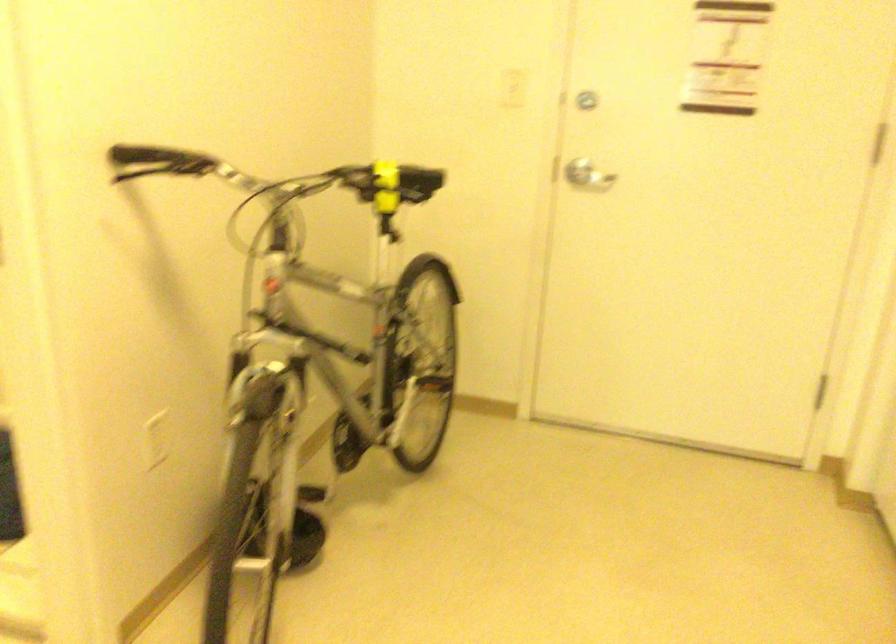
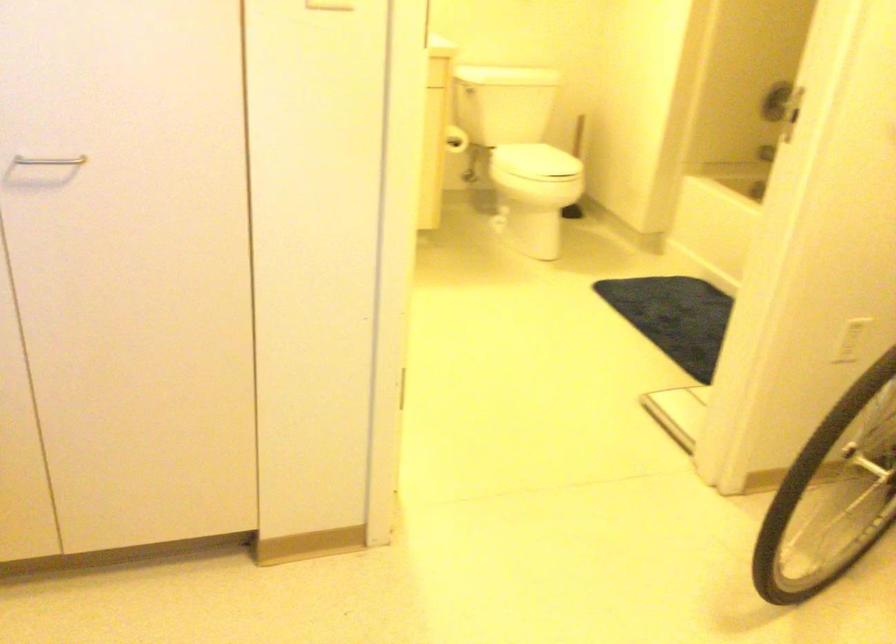
Question: The camera is either moving clockwise (left) or counter-clockwise (right) around the object. The first image is from the beginning of the video and the second image is from the end. Is the camera moving left or right when shooting the video?

Choices:
 (A) Left
 (B) Right

Answer: (B)